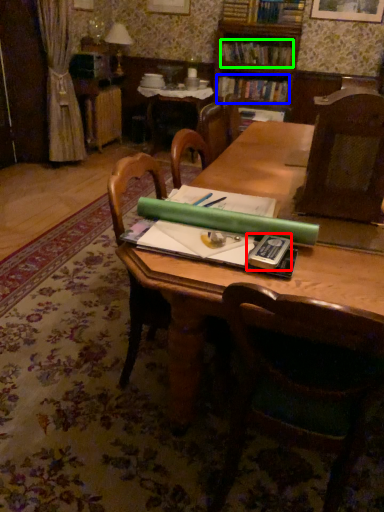
Question: Which is farther away from paperback book (highlighted by a red box)? book (highlighted by a blue box) or book (highlighted by a green box)?

Choices:
 (A) book
 (B) book

Answer: (B)